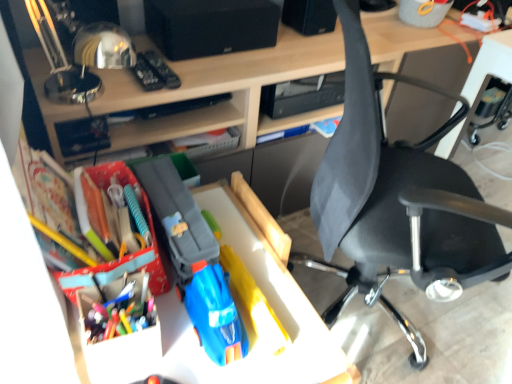
Question: Is matte plastic toy car at center a part of matte plastic desk at center?

Choices:
 (A) yes
 (B) no

Answer: (B)

Question: Is matte plastic desk at center in contact with matte plastic toy car at center?

Choices:
 (A) no
 (B) yes

Answer: (A)

Question: Is matte plastic desk at center wider than matte plastic toy car at center?

Choices:
 (A) yes
 (B) no

Answer: (B)

Question: Is matte plastic desk at center shorter than matte plastic toy car at center?

Choices:
 (A) yes
 (B) no

Answer: (B)

Question: Can you confirm if matte plastic desk at center is smaller than matte plastic toy car at center?

Choices:
 (A) no
 (B) yes

Answer: (A)

Question: Is point (389, 185) positioned closer to the camera than point (144, 294)?

Choices:
 (A) farther
 (B) closer

Answer: (A)

Question: Would you say black fabric chair at right is inside or outside multicolored plastic pen at center left?

Choices:
 (A) inside
 (B) outside

Answer: (B)

Question: Looking at their shapes, would you say black fabric chair at right is wider or thinner than multicolored plastic pen at center left?

Choices:
 (A) wide
 (B) thin

Answer: (A)

Question: From their relative heights in the image, would you say black fabric chair at right is taller or shorter than multicolored plastic pen at center left?

Choices:
 (A) tall
 (B) short

Answer: (A)

Question: Is black matte speaker at upper center in front of or behind black fabric chair at right in the image?

Choices:
 (A) behind
 (B) front

Answer: (A)

Question: Would you say black matte speaker at upper center is inside or outside black fabric chair at right?

Choices:
 (A) outside
 (B) inside

Answer: (A)

Question: In terms of width, does black matte speaker at upper center look wider or thinner when compared to black fabric chair at right?

Choices:
 (A) thin
 (B) wide

Answer: (A)

Question: In the image, is black matte speaker at upper center on the left side or the right side of black fabric chair at right?

Choices:
 (A) left
 (B) right

Answer: (A)

Question: From their relative heights in the image, would you say multicolored plastic pen at center left is taller or shorter than black fabric chair at right?

Choices:
 (A) tall
 (B) short

Answer: (B)

Question: Considering the positions of multicolored plastic pen at center left and black fabric chair at right in the image, is multicolored plastic pen at center left wider or thinner than black fabric chair at right?

Choices:
 (A) thin
 (B) wide

Answer: (A)